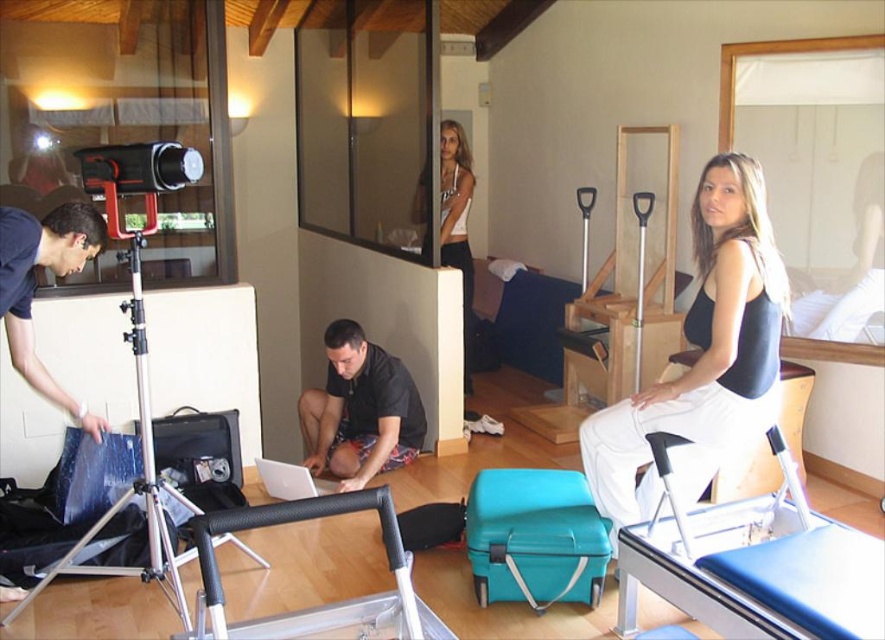
Question: Which point is farther from the camera taking this photo?

Choices:
 (A) (19, 246)
 (B) (329, 470)

Answer: (B)

Question: Does matte blue jeans at left appear under white plastic laptop at center?

Choices:
 (A) yes
 (B) no

Answer: (B)

Question: Which point appears closest to the camera in this image?

Choices:
 (A) (54, 262)
 (B) (725, 172)
 (C) (442, 204)
 (D) (394, 529)

Answer: (D)

Question: Which of these objects is positioned farthest from the black matte laptop at center?

Choices:
 (A) white fabric chair at right
 (B) matte blue jeans at left

Answer: (A)

Question: Does matte black tank top at center lie in front of silver metallic tripod at left?

Choices:
 (A) yes
 (B) no

Answer: (A)

Question: Does silver metallic tripod at left have a lesser width compared to black rubber handle at center?

Choices:
 (A) yes
 (B) no

Answer: (B)